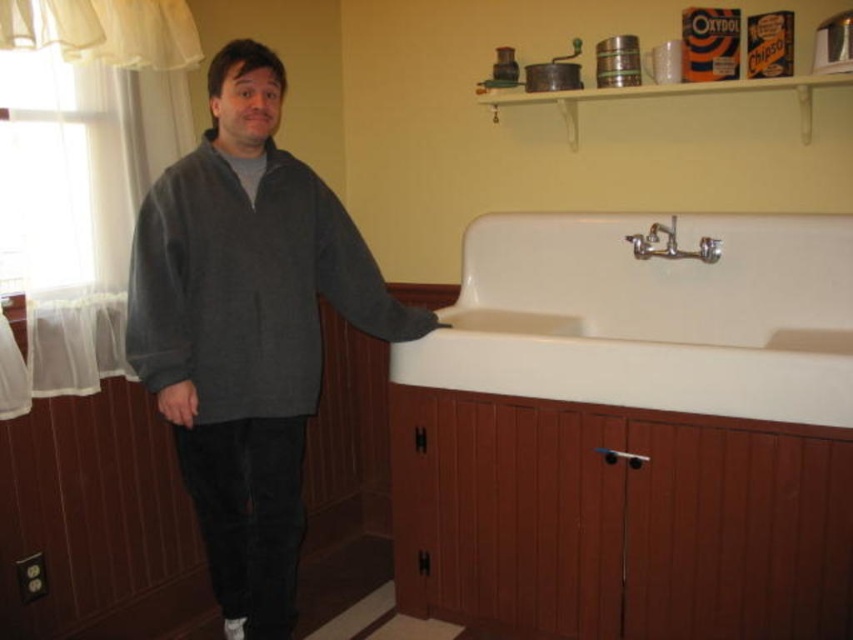
Question: Is white porcelain sink at center to the left of silver metallic faucet at upper center from the viewer's perspective?

Choices:
 (A) no
 (B) yes

Answer: (B)

Question: Which point is farther to the camera?

Choices:
 (A) (171, 177)
 (B) (181, 392)
 (C) (706, 253)

Answer: (C)

Question: Where is white porcelain sink at center located in relation to silver metallic faucet at upper center in the image?

Choices:
 (A) above
 (B) below

Answer: (B)

Question: Can you confirm if gray fleece jacket at center is positioned to the right of matte gray sweater at lower left?

Choices:
 (A) no
 (B) yes

Answer: (B)

Question: Which is nearer to the gray fleece jacket at center?

Choices:
 (A) silver metallic faucet at upper center
 (B) matte gray sweater at lower left

Answer: (B)

Question: Which point appears farthest from the camera in this image?

Choices:
 (A) (677, 339)
 (B) (637, 250)
 (C) (270, 330)
 (D) (186, 410)

Answer: (A)